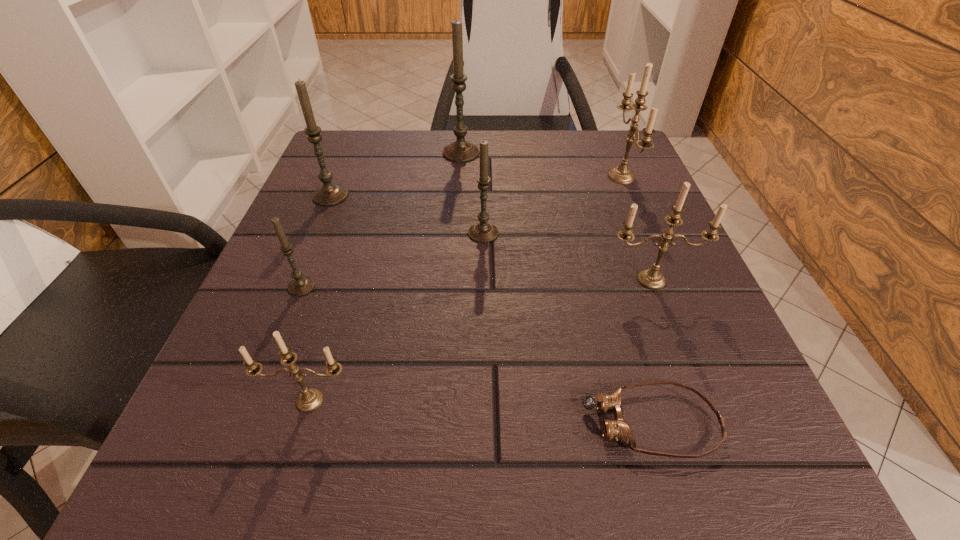
The height and width of the screenshot is (540, 960). I want to click on vacant position at the far left corner of the desktop, so click(329, 160).

I want to click on blank space at the near left corner of the desktop, so 285,494.

Image resolution: width=960 pixels, height=540 pixels. In order to click on vacant space at the near right corner of the desktop in this screenshot , I will do `click(664, 447)`.

Identify the location of vacant area that lies between the second farthest gray candle and the farthest gray candle. Image resolution: width=960 pixels, height=540 pixels. (396, 174).

Locate an element on the screen. Image resolution: width=960 pixels, height=540 pixels. vacant area that lies between the fourth farthest object and the smallest gray candle is located at coordinates (393, 260).

You are a GUI agent. You are given a task and a screenshot of the screen. Output one action in this format:
    pyautogui.click(x=<x>, y=<y>)
    Task: Click on the blank region between the smallest gray candle and the biggest metallic candle
    
    Given the screenshot: What is the action you would take?
    pyautogui.click(x=462, y=232)

Locate an element on the screen. The image size is (960, 540). empty space between the third nearest gray candle and the nearest gray candle is located at coordinates (316, 241).

The image size is (960, 540). I want to click on free space that is in between the fifth nearest object and the farthest metallic candle, so click(552, 205).

Find the location of `vacant space that's between the biggest metallic candle and the smallest gray candle`. vacant space that's between the biggest metallic candle and the smallest gray candle is located at coordinates (462, 232).

The height and width of the screenshot is (540, 960). I want to click on free space that is in between the third smallest gray candle and the leftmost metallic candle, so click(x=321, y=298).